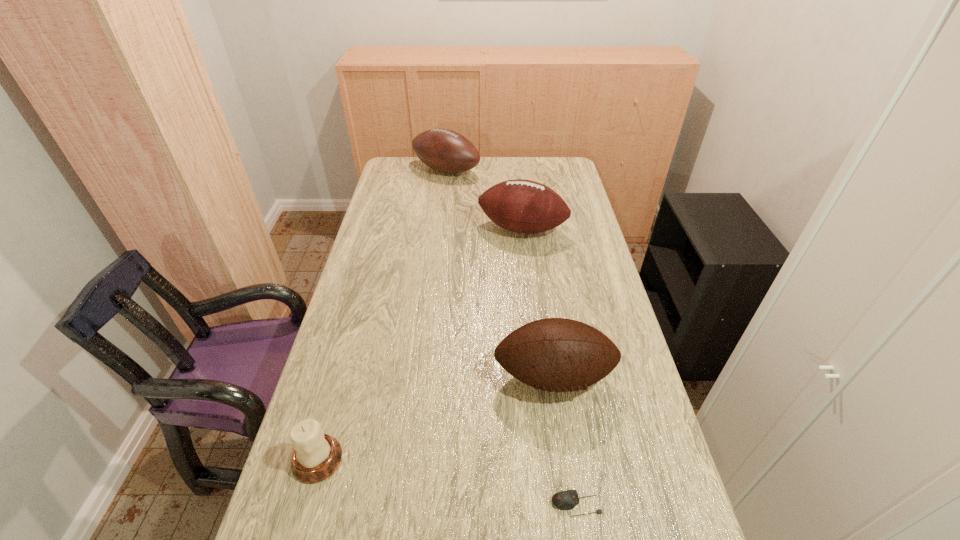
At what (x,y) coordinates should I click in order to perform the action: click on vacant space located on the right of the leftmost object. Please return your answer as a coordinate pair (x, y). The height and width of the screenshot is (540, 960). Looking at the image, I should click on (431, 460).

Find the location of a particular element. The image size is (960, 540). vacant space located 0.100m on the left of the nearest object is located at coordinates (504, 504).

This screenshot has width=960, height=540. Identify the location of object at the far edge. (446, 151).

The width and height of the screenshot is (960, 540). Identify the location of football (American) present at the left edge. click(446, 151).

Find the location of `candle holder located in the left edge section of the desktop`. candle holder located in the left edge section of the desktop is located at coordinates (316, 456).

Locate an element on the screen. mouse present at the right edge is located at coordinates (565, 500).

Identify the location of object situated at the far left corner. pyautogui.click(x=446, y=151).

You are a GUI agent. You are given a task and a screenshot of the screen. Output one action in this format:
    pyautogui.click(x=<x>, y=<y>)
    Task: Click on the free region at the far edge of the desktop
    The width and height of the screenshot is (960, 540).
    Given the screenshot: What is the action you would take?
    pyautogui.click(x=475, y=176)

The image size is (960, 540). What are the coordinates of `blank area at the left edge` in the screenshot? It's located at (378, 353).

Identify the location of vacant area at the right edge. Image resolution: width=960 pixels, height=540 pixels. (566, 256).